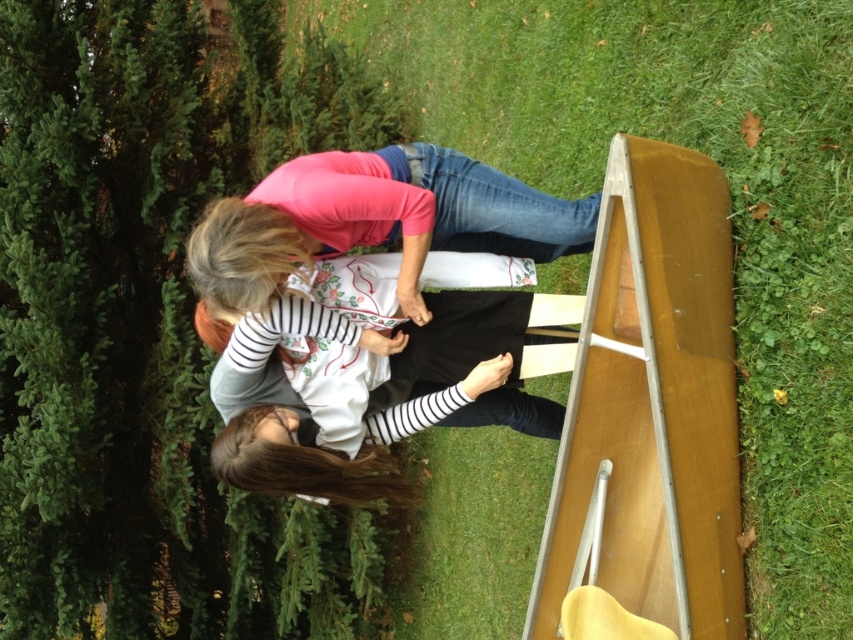
Question: Which object is the closest to the wooden ramp at lower right?

Choices:
 (A) pink matte shirt at center
 (B) green grass at lower right

Answer: (B)

Question: Does green grass at lower right lie behind wooden ramp at lower right?

Choices:
 (A) no
 (B) yes

Answer: (A)

Question: Based on their relative distances, which object is nearer to the green grass at lower right?

Choices:
 (A) wooden ramp at lower right
 (B) pink matte shirt at center

Answer: (A)

Question: Is green grass at lower right smaller than wooden ramp at lower right?

Choices:
 (A) no
 (B) yes

Answer: (A)

Question: Which point is farther from the camera taking this photo?

Choices:
 (A) (756, 218)
 (B) (276, 275)

Answer: (A)

Question: Is wooden ramp at lower right positioned in front of pink matte shirt at center?

Choices:
 (A) no
 (B) yes

Answer: (B)